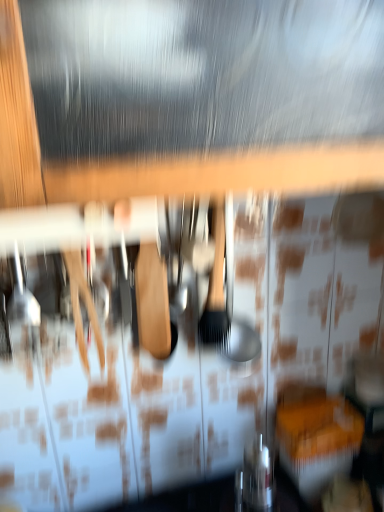
The image size is (384, 512). Describe the element at coordinates (217, 285) in the screenshot. I see `black rubber spatula at center` at that location.

Locate an element on the screen. black rubber spatula at center is located at coordinates (217, 285).

Measure the distance between point (211, 336) and camera.

Point (211, 336) is 31.14 inches away from camera.

Locate an element on the screen. black rubber spatula at center is located at coordinates (217, 285).